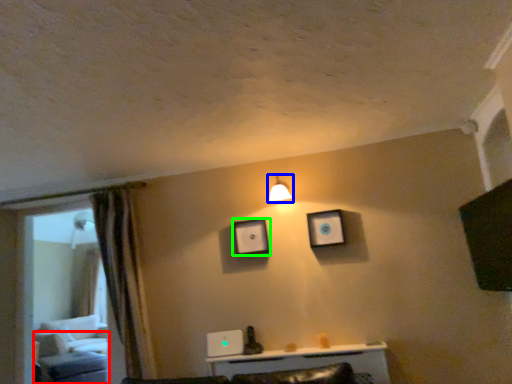
Question: Which is nearer to the furniture (highlighted by a red box)? light fixture (highlighted by a blue box) or picture frame (highlighted by a green box).

Choices:
 (A) light fixture
 (B) picture frame

Answer: (B)